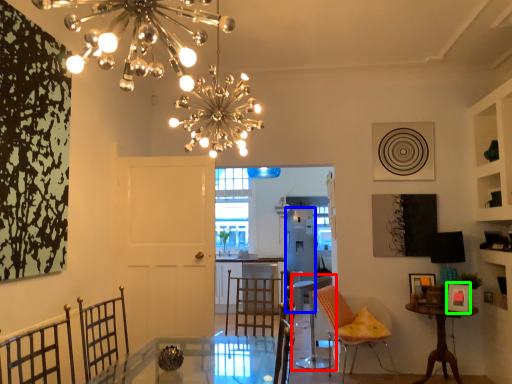
Question: Based on their relative distances, which object is farther from chair (highlighted by a red box)? Choose from appliance (highlighted by a blue box) and picture frame (highlighted by a green box).

Choices:
 (A) appliance
 (B) picture frame

Answer: (B)